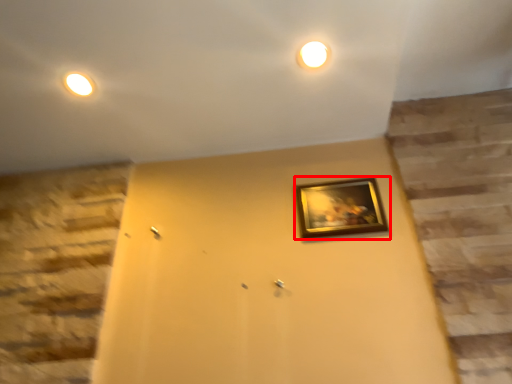
Question: Where is picture frame (annotated by the red box) located in relation to light in the image?

Choices:
 (A) left
 (B) right

Answer: (B)